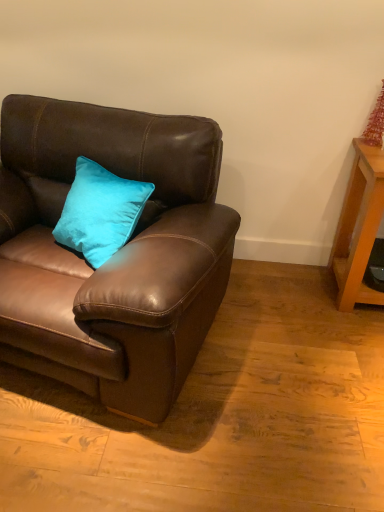
Question: Would you say brown leather couch at left is outside wooden table at right?

Choices:
 (A) no
 (B) yes

Answer: (B)

Question: Does brown leather couch at left touch wooden table at right?

Choices:
 (A) yes
 (B) no

Answer: (B)

Question: From a real-world perspective, is brown leather couch at left on wooden table at right?

Choices:
 (A) no
 (B) yes

Answer: (B)

Question: Considering the relative sizes of brown leather couch at left and wooden table at right in the image provided, is brown leather couch at left smaller than wooden table at right?

Choices:
 (A) no
 (B) yes

Answer: (A)

Question: Is the depth of brown leather couch at left less than that of wooden table at right?

Choices:
 (A) no
 (B) yes

Answer: (B)

Question: Can you confirm if brown leather couch at left is shorter than wooden table at right?

Choices:
 (A) no
 (B) yes

Answer: (A)

Question: Considering the relative positions of wooden table at right and brown leather couch at left in the image provided, is wooden table at right to the right of brown leather couch at left from the viewer's perspective?

Choices:
 (A) no
 (B) yes

Answer: (B)

Question: Does wooden table at right have a lesser width compared to brown leather couch at left?

Choices:
 (A) yes
 (B) no

Answer: (A)

Question: From a real-world perspective, is wooden table at right on top of brown leather couch at left?

Choices:
 (A) yes
 (B) no

Answer: (B)

Question: Is wooden table at right with brown leather couch at left?

Choices:
 (A) yes
 (B) no

Answer: (B)

Question: Is wooden table at right closer to the viewer compared to brown leather couch at left?

Choices:
 (A) no
 (B) yes

Answer: (A)

Question: Is wooden table at right not inside brown leather couch at left?

Choices:
 (A) no
 (B) yes

Answer: (B)

Question: From a real-world perspective, is brown leather couch at left physically located above or below wooden table at right?

Choices:
 (A) above
 (B) below

Answer: (A)